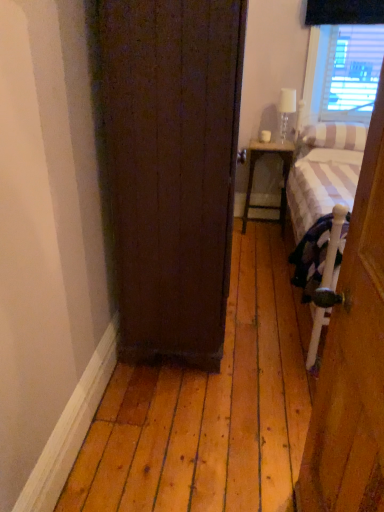
Where is `vacant space to the right of dark wood door at center, arranged as the second door when viewed from the front`? vacant space to the right of dark wood door at center, arranged as the second door when viewed from the front is located at coordinates (265, 319).